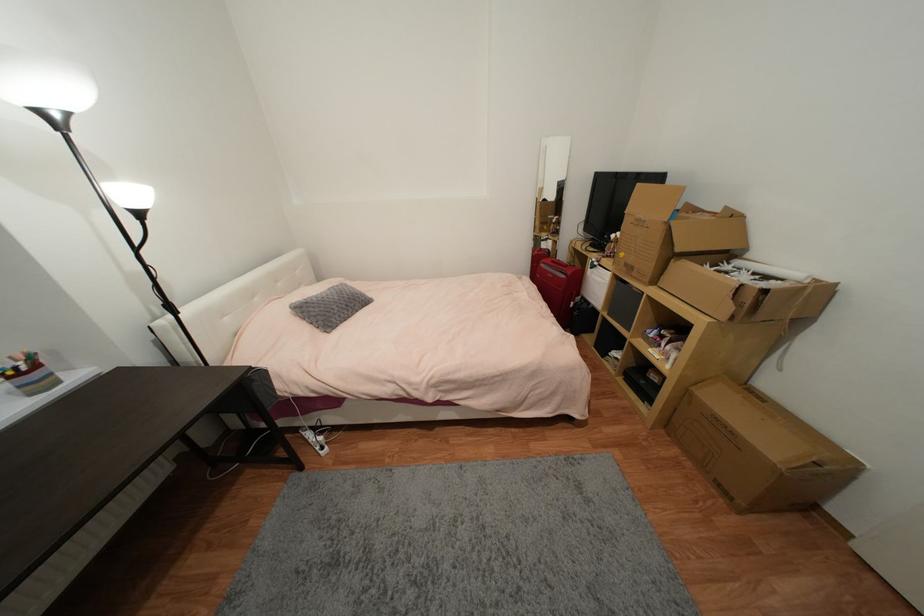
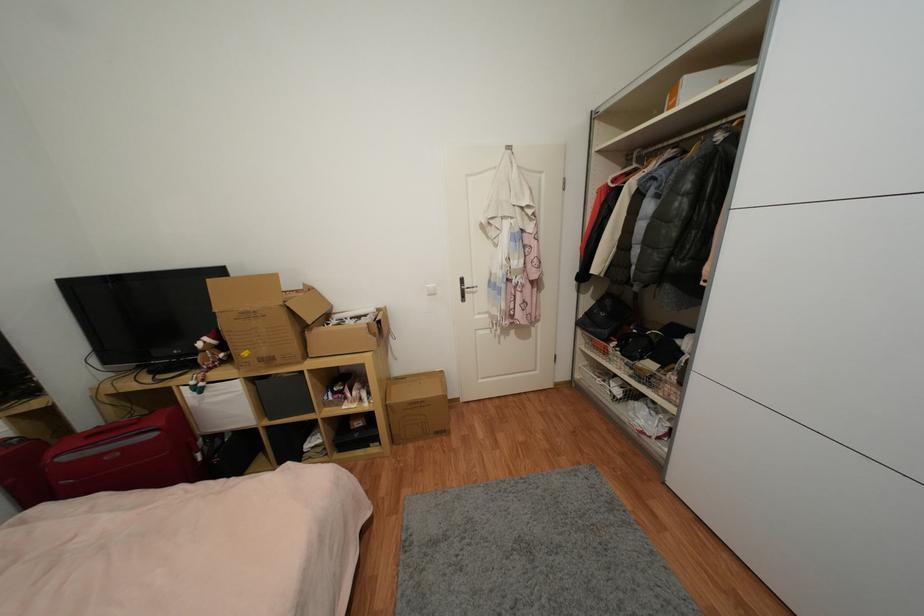
Where in the second image is the point corresponding to pixel 567 278 from the first image?

(157, 436)